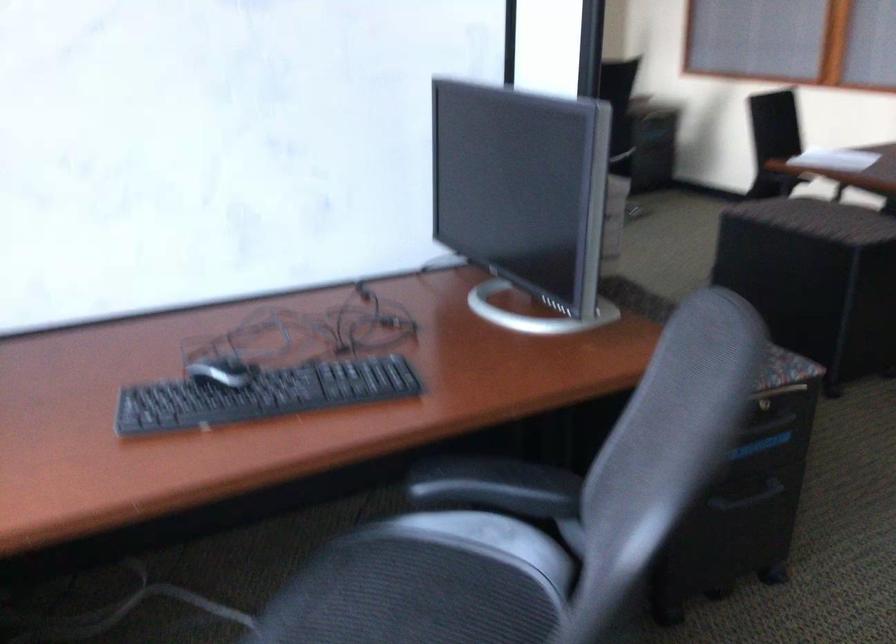
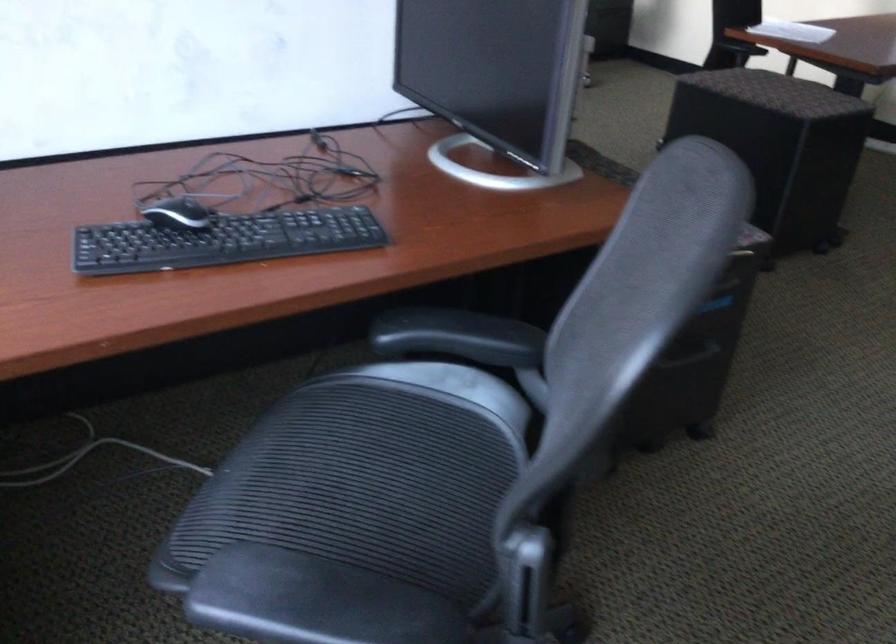
Locate, in the second image, the point that corresponds to [494,488] in the first image.

(458, 337)